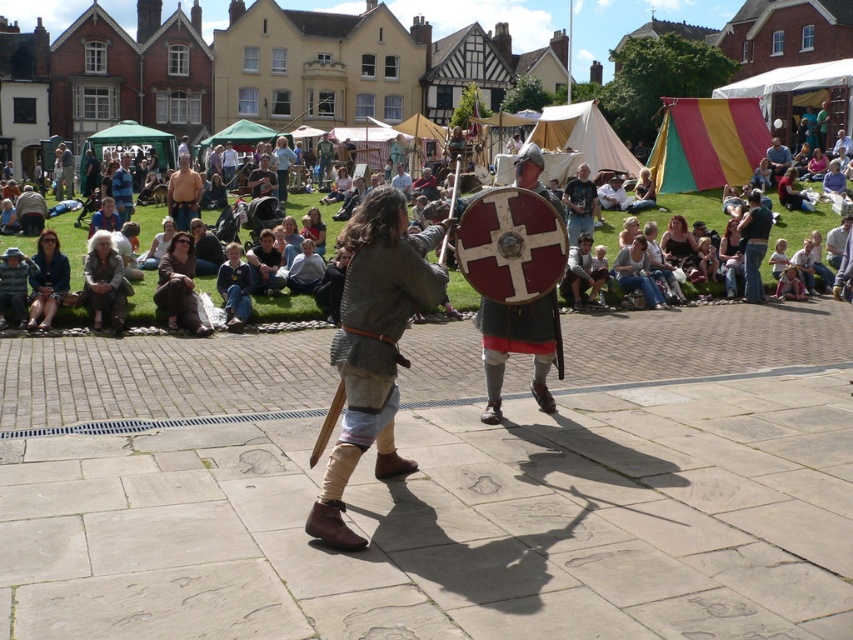
Is light brown fabric seats at center positioned before dark gray t-shirt at center?

Yes, light brown fabric seats at center is closer to the viewer.

Between light brown fabric seats at center and dark gray t-shirt at center, which one is positioned higher?

dark gray t-shirt at center

Does point (143, 230) come behind point (569, 214)?

Yes.

Image resolution: width=853 pixels, height=640 pixels. I want to click on light brown fabric seats at center, so click(x=689, y=209).

In order to click on light brown fabric seats at center in this screenshot , I will do `click(689, 209)`.

Consider the image. Does light brown fabric seats at center have a lesser height compared to smooth brown leather jacket at center?

No.

Does point (129, 308) lie behind point (775, 161)?

No, it is not.

This screenshot has height=640, width=853. I want to click on light brown fabric seats at center, so click(x=689, y=209).